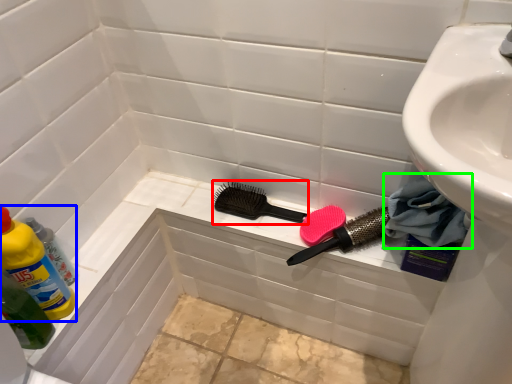
Question: Which is nearer to the brush (highlighted by a red box)? cleaning product (highlighted by a blue box) or material (highlighted by a green box).

Choices:
 (A) cleaning product
 (B) material

Answer: (B)